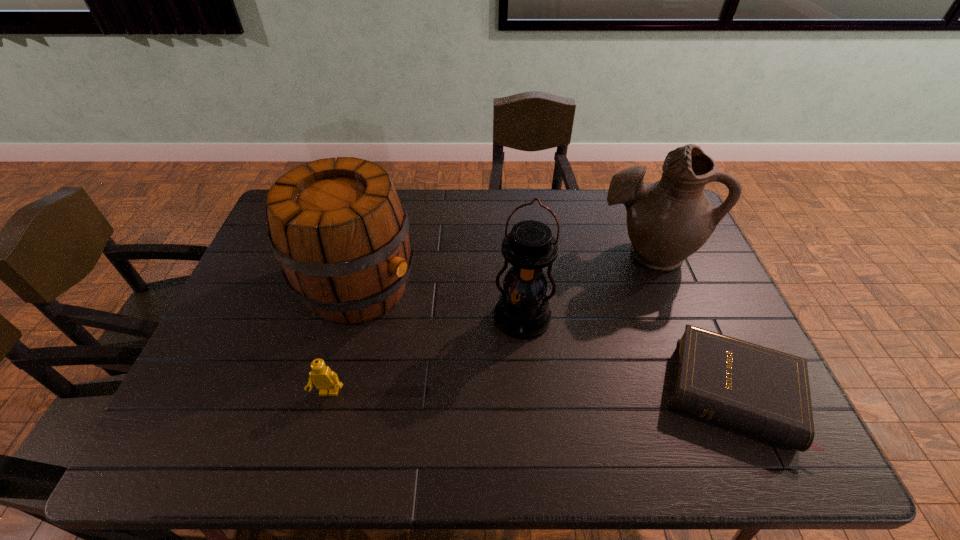
In order to click on vacant position located at the spout of the pitcher in this screenshot , I will do `click(564, 342)`.

This screenshot has height=540, width=960. In order to click on vacant area situated at the spout of the pitcher in this screenshot , I will do `click(601, 299)`.

Image resolution: width=960 pixels, height=540 pixels. What are the coordinates of `free point located on the side of the cider where the spigot is located` in the screenshot? It's located at (506, 361).

At what (x,y) coordinates should I click in order to perform the action: click on vacant point located on the side of the cider where the spigot is located. Please return your answer as a coordinate pair (x, y). Looking at the image, I should click on (487, 351).

I want to click on vacant area situated 0.150m on the side of the cider where the spigot is located, so click(449, 332).

The width and height of the screenshot is (960, 540). Identify the location of object that is at the far edge. (667, 221).

Where is `Lego that is positioned at the near edge`? Lego that is positioned at the near edge is located at coordinates tap(324, 379).

The height and width of the screenshot is (540, 960). Find the location of `Bible that is positioned at the near edge`. Bible that is positioned at the near edge is located at coordinates (764, 392).

Image resolution: width=960 pixels, height=540 pixels. I want to click on object at the left edge, so click(x=338, y=228).

In order to click on Bible present at the right edge in this screenshot , I will do `click(764, 392)`.